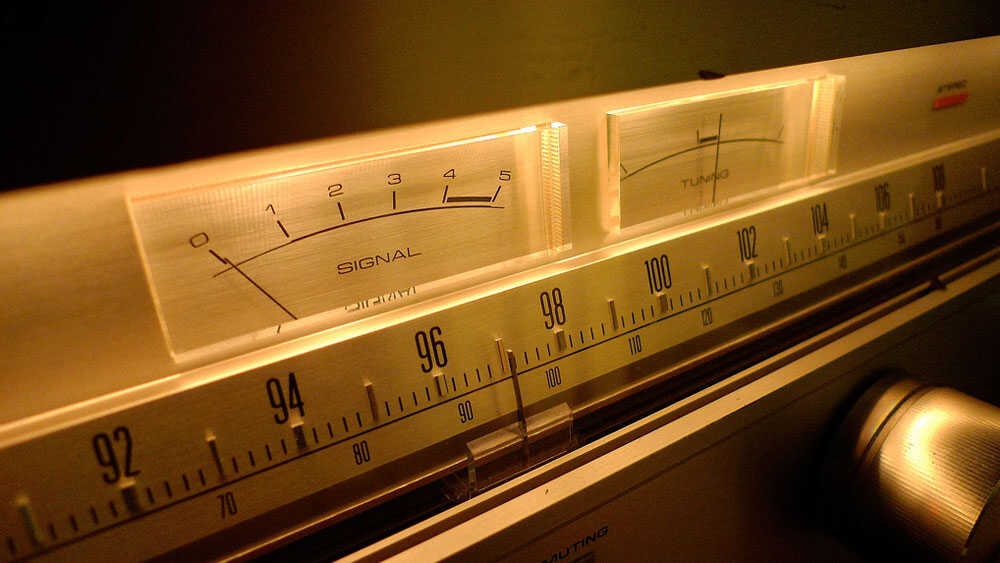
The image size is (1000, 563). I want to click on vintage radio, so click(477, 51).